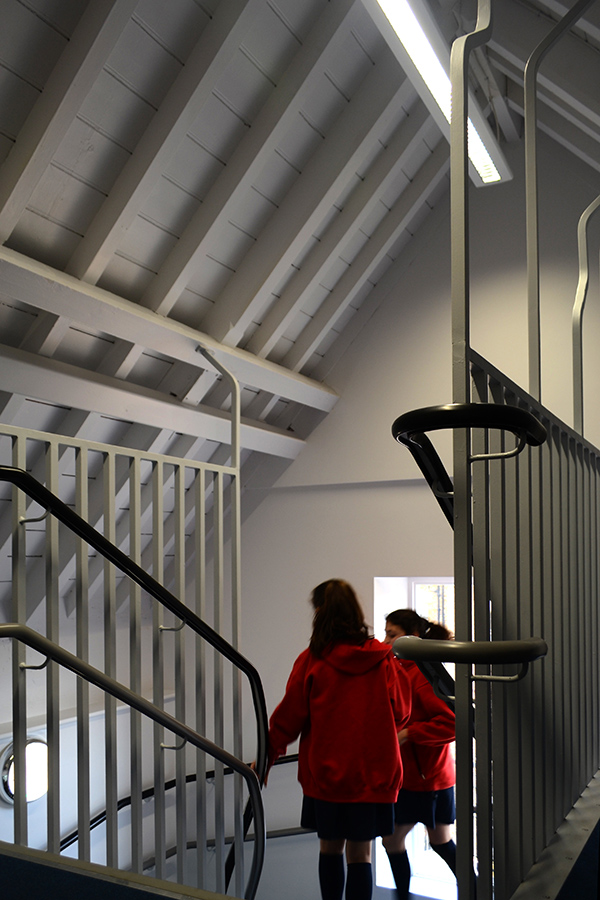
Where is `light`? light is located at coordinates (34, 774).